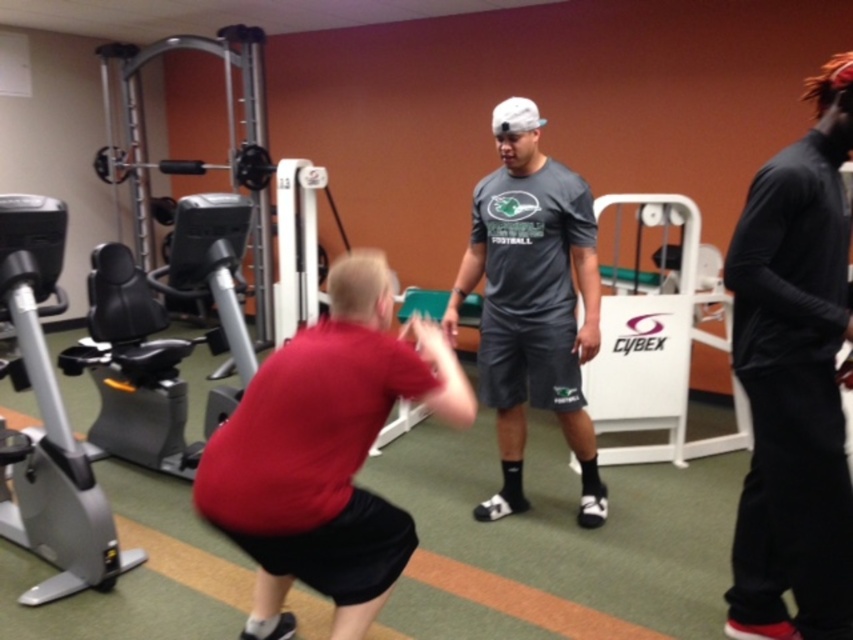
Who is more forward, (775, 257) or (498, 397)?

Point (775, 257)

Between black matte pants at right and dark gray t-shirt at center, which one appears on the left side from the viewer's perspective?

Positioned to the left is dark gray t-shirt at center.

Is point (738, 291) positioned after point (489, 317)?

No, (738, 291) is closer to viewer.

Find the location of a particular element. black matte pants at right is located at coordinates (793, 380).

Who is positioned more to the left, silver metallic exercise bike at left or white plastic cybex machine at center?

From the viewer's perspective, silver metallic exercise bike at left appears more on the left side.

Is point (10, 298) more distant than point (689, 269)?

No, (10, 298) is in front of (689, 269).

At what (x,y) coordinates should I click in order to perform the action: click on silver metallic exercise bike at left. Please return your answer as a coordinate pair (x, y). The height and width of the screenshot is (640, 853). Looking at the image, I should click on coord(50,420).

Is black matte pants at right closer to camera compared to white plastic cybex machine at center?

Yes, it is.

Does black matte pants at right appear on the right side of white plastic cybex machine at center?

No, black matte pants at right is not to the right of white plastic cybex machine at center.

You are a GUI agent. You are given a task and a screenshot of the screen. Output one action in this format:
    pyautogui.click(x=<x>, y=<y>)
    Task: Click on the black matte pants at right
    Image resolution: width=853 pixels, height=640 pixels.
    Given the screenshot: What is the action you would take?
    pyautogui.click(x=793, y=380)

Where is `black matte pants at right`? The height and width of the screenshot is (640, 853). black matte pants at right is located at coordinates (793, 380).